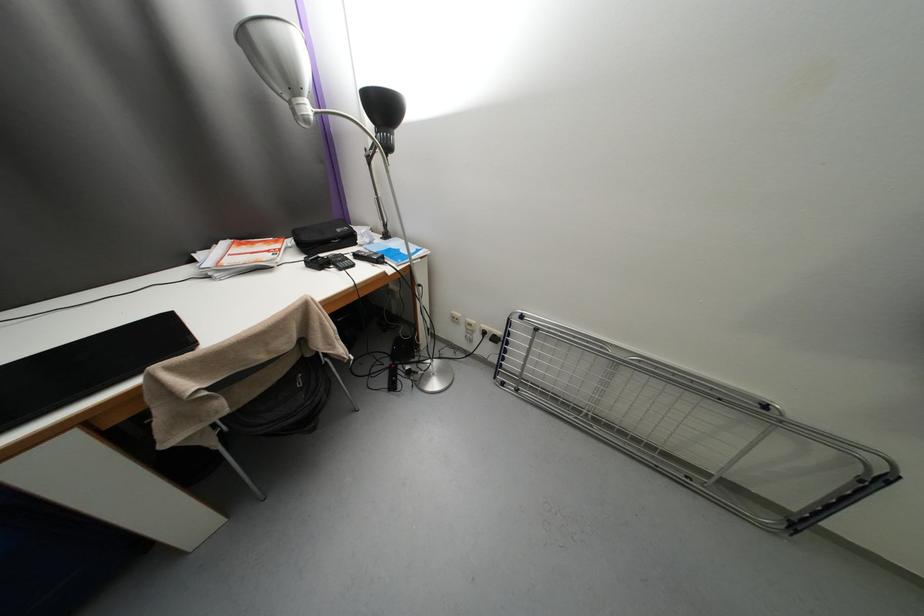
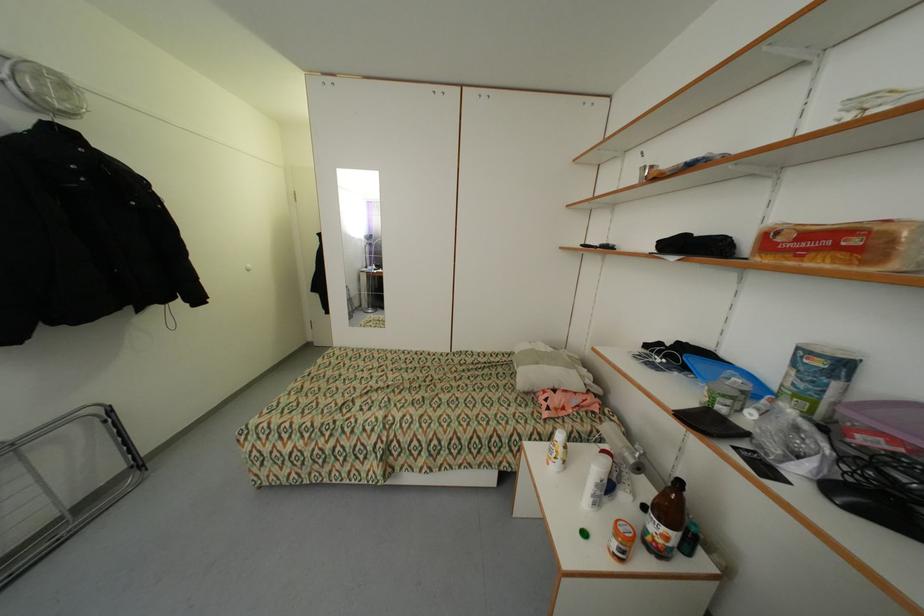
Find the pixel in the second image that matches point (868, 482) in the first image.

(112, 422)